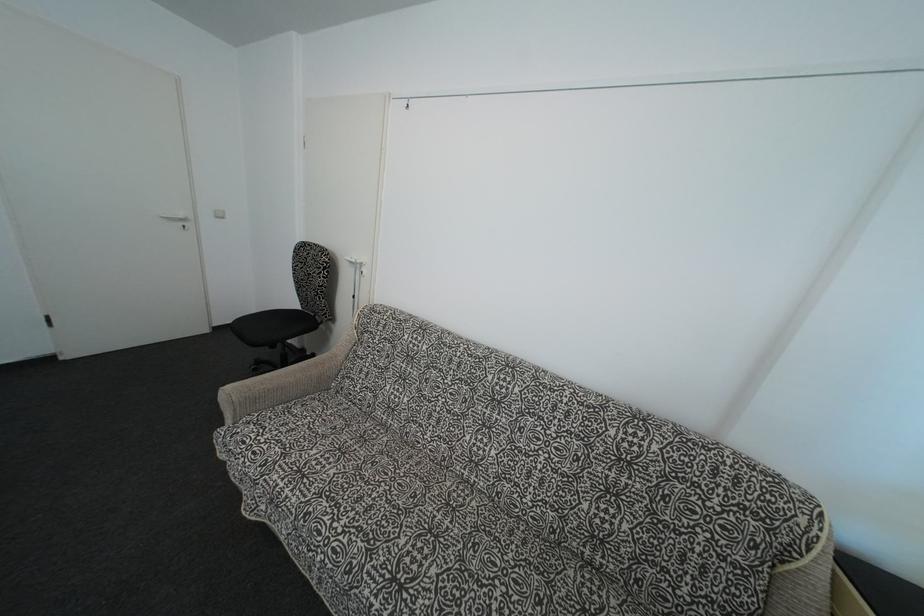
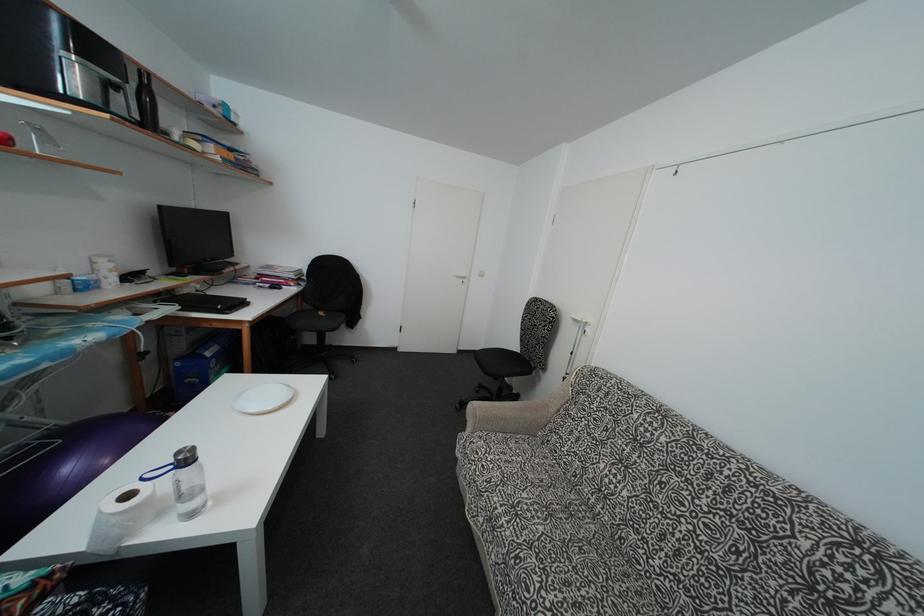
The point at (323, 541) is marked in the first image. Where is the corresponding point in the second image?

(532, 598)